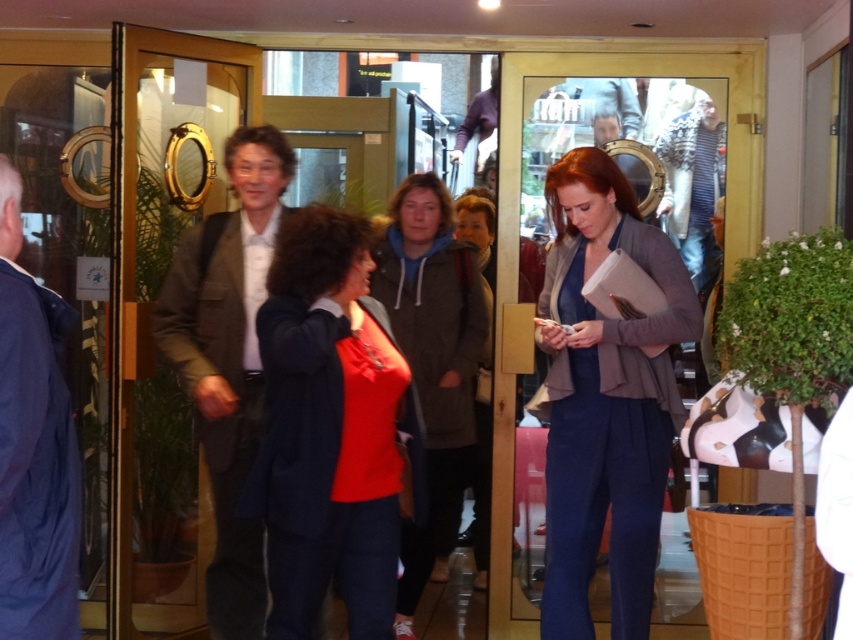
You are a visitor at this building and want to enter through the entrance. The clear glass door at center and the matte red blouse at center are both in your line of sight. Which object is physically closer to you?

The clear glass door at center is larger in size than the matte red blouse at center, so the clear glass door at center is closer to you because objects closer to the viewer appear larger.

You are a delivery person carrying a large box that is 3 feet wide. You need to pass through the clear glass door at center while avoiding the blue woolen suit at center. Is there enough space between them to move through?

The clear glass door at center and blue woolen suit at center are 5.62 feet apart. Since your box is 3 feet wide, there is sufficient space to pass through as 5.62 feet is greater than 3 feet.

You are a delivery person carrying a box that is 1.2 meters wide. You need to pass through the clear glass door at center and the matte red blouse at center. Which one can your box fit through based on their widths?

The clear glass door at center has a larger width than the matte red blouse at center, so the box can fit through the clear glass door at center but not the matte red blouse at center.